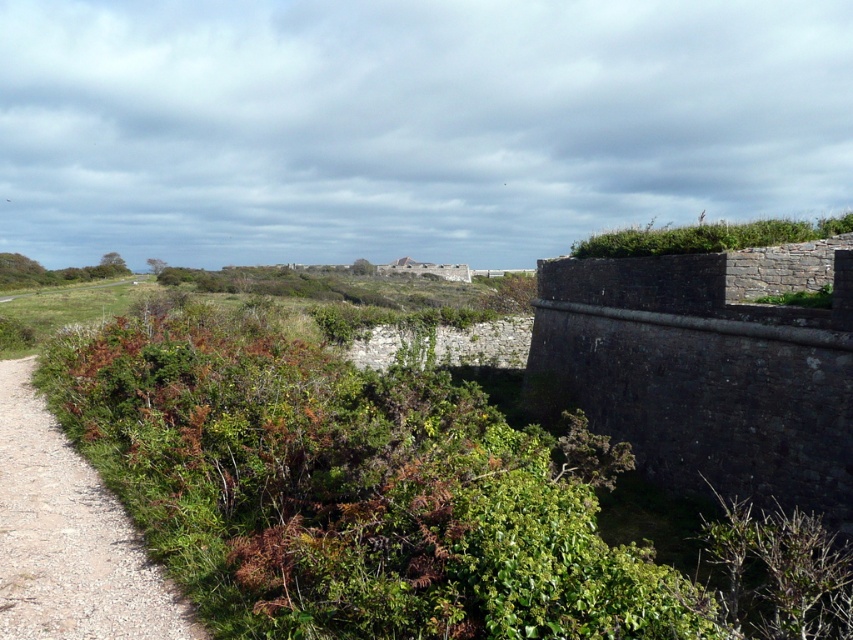
Does point (712, 348) lie in front of point (744, 244)?

Yes, it is.

Locate an element on the screen. This screenshot has height=640, width=853. dark gray stone wall at right is located at coordinates (706, 368).

Who is more forward, [177,621] or [614,243]?

Point [177,621]

Between point (80, 608) and point (628, 256), which one is positioned in front?

Point (80, 608) is more forward.

Where is `green leafy trail at left`? The width and height of the screenshot is (853, 640). green leafy trail at left is located at coordinates (68, 538).

Which is in front, point (741, 260) or point (77, 467)?

Positioned in front is point (77, 467).

Does point (809, 285) come farther from viewer compared to point (22, 436)?

Yes, it is behind point (22, 436).

This screenshot has width=853, height=640. Find the location of `dark gray stone wall at right`. dark gray stone wall at right is located at coordinates (706, 368).